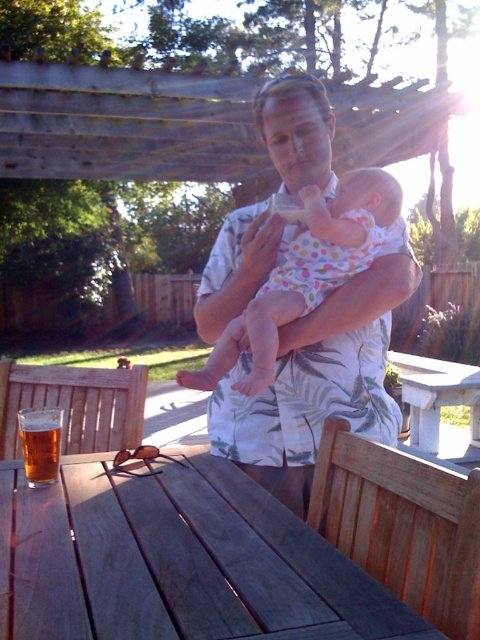
Is point (381, 356) in front of point (365, 244)?

No, (381, 356) is further to viewer.

Who is more forward, (362, 433) or (379, 240)?

Point (362, 433)

Find the location of a particular element. This screenshot has height=640, width=480. white floral shirt at center is located at coordinates (317, 380).

Looking at this image, can you confirm if wooden table at center is shorter than golden amber liquid at table left?

Correct, wooden table at center is not as tall as golden amber liquid at table left.

Which of these two, wooden table at center or golden amber liquid at table left, stands taller?

With more height is golden amber liquid at table left.

What do you see at coordinates (177, 561) in the screenshot? I see `wooden table at center` at bounding box center [177, 561].

Find the location of a particular element. This screenshot has height=640, width=480. wooden table at center is located at coordinates (177, 561).

Is white floral shirt at center bigger than white stone picnic table at center?

No.

Is point (317, 369) farther from camera compared to point (466, 380)?

No.

Find the location of `white floral shirt at center`. white floral shirt at center is located at coordinates (317, 380).